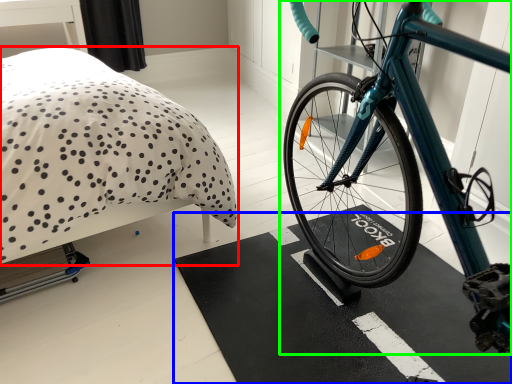
Question: Which is farther away from bed (highlighted by a red box)? bath mat (highlighted by a blue box) or bicycle (highlighted by a green box)?

Choices:
 (A) bath mat
 (B) bicycle

Answer: (B)